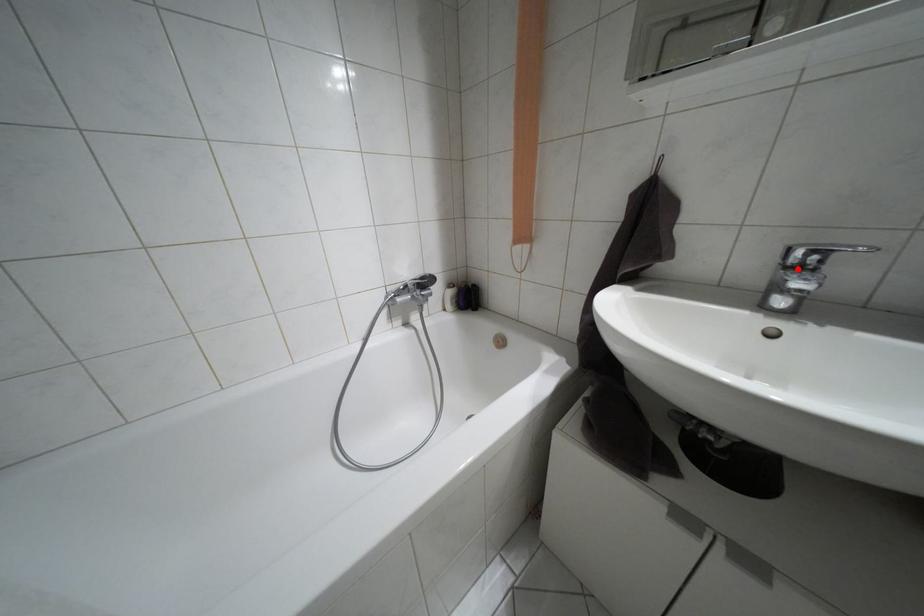
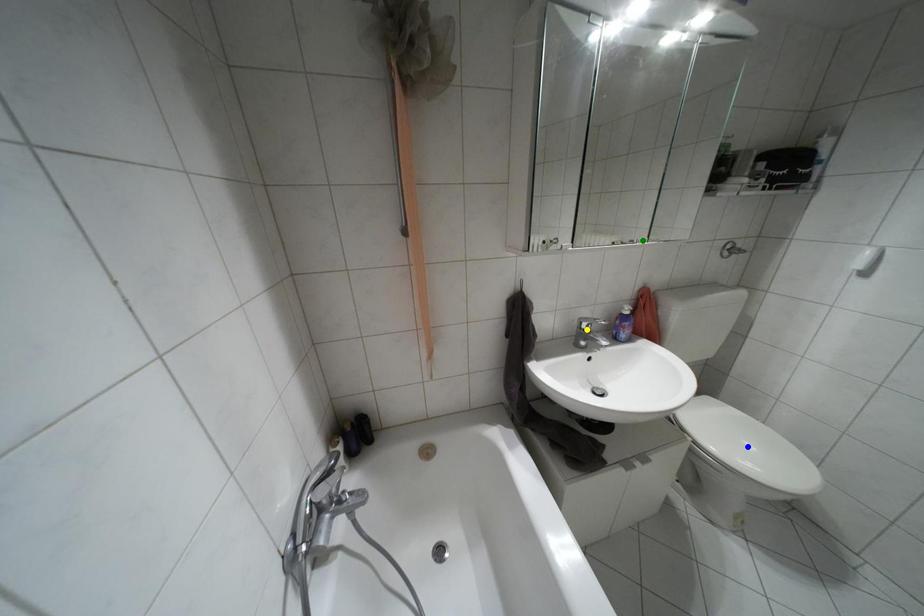
Question: I am providing you with two images of the same scene from different viewpoints. A red point is marked on the first image. You are given multiple points on the second image. Can you choose the point in image 2 that corresponds to the point in image 1?

Choices:
 (A) yellow point
 (B) blue point
 (C) green point

Answer: (A)